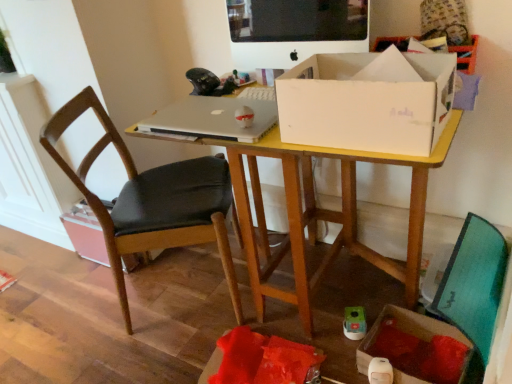
The height and width of the screenshot is (384, 512). Find the location of `vacant space underneath black leather chair at left (from a real-world perspective)`. vacant space underneath black leather chair at left (from a real-world perspective) is located at coordinates [172, 287].